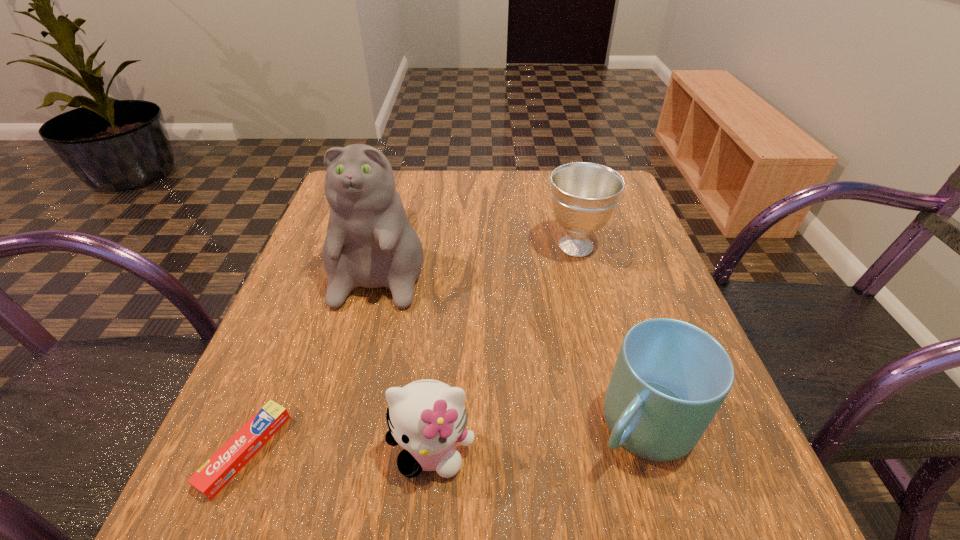
This screenshot has height=540, width=960. What are the coordinates of `object positioned at the far edge` in the screenshot? It's located at (370, 243).

Image resolution: width=960 pixels, height=540 pixels. Find the location of `mug at the near edge`. mug at the near edge is located at coordinates (670, 378).

The width and height of the screenshot is (960, 540). I want to click on kitten that is at the near edge, so click(x=427, y=417).

Locate an element on the screen. The width and height of the screenshot is (960, 540). toothpaste that is at the near edge is located at coordinates (213, 476).

Find the location of a particular element. cat at the left edge is located at coordinates (370, 243).

Image resolution: width=960 pixels, height=540 pixels. In order to click on toothpaste that is at the left edge in this screenshot , I will do `click(213, 476)`.

Where is `chalice that is positioned at the right edge`? chalice that is positioned at the right edge is located at coordinates (584, 195).

This screenshot has width=960, height=540. I want to click on mug that is at the right edge, so click(x=670, y=378).

Locate an element on the screen. The height and width of the screenshot is (540, 960). object present at the far left corner is located at coordinates (370, 243).

At what (x,y) coordinates should I click in order to perform the action: click on object located in the near left corner section of the desktop. Please return your answer as a coordinate pair (x, y). Looking at the image, I should click on (213, 476).